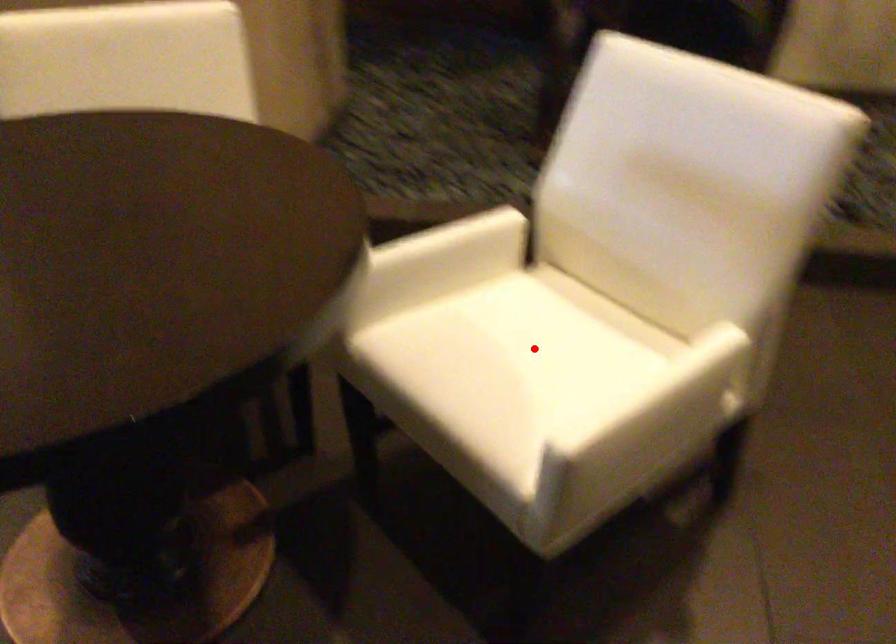
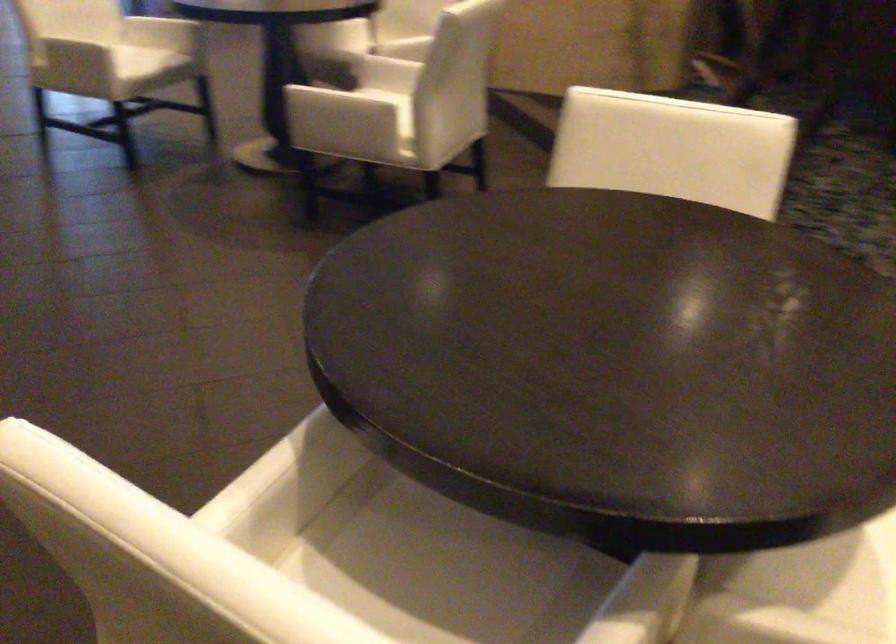
Question: I am providing you with two images of the same scene from different viewpoints. A red point is marked on the first image. At the location where the point appears in image 1, is it still visible in image 2?

Choices:
 (A) Yes
 (B) No

Answer: (B)